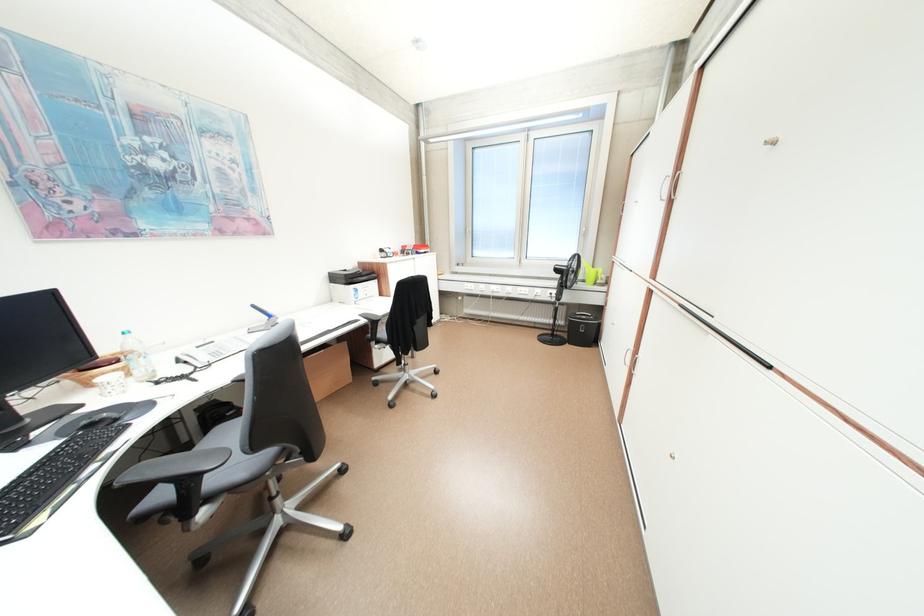
Describe the element at coordinates (225, 440) in the screenshot. The width and height of the screenshot is (924, 616). I see `the grey chair sitting surface` at that location.